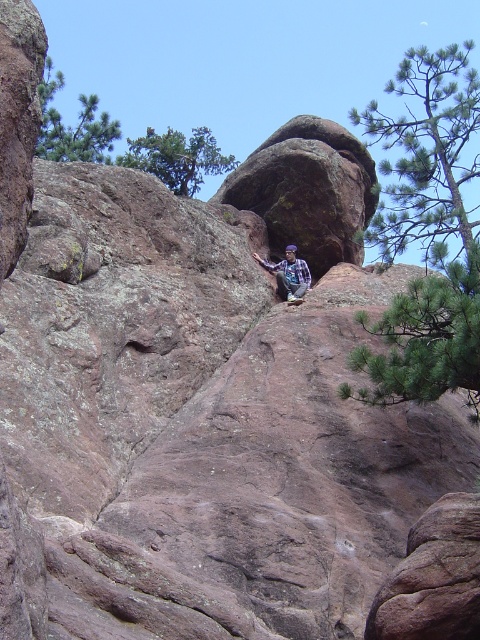
You are an outdoor enthusiast planning to take a photo of the large rock formation. You notice two trees in the upper left corner of your viewfinder. Which tree, the green leafy tree at upper left or the green textured pine tree at upper left, would be a better choice to include in the foreground to frame the rock formation without blocking it?

The green leafy tree at upper left is thinner than the green textured pine tree at upper left, so the green leafy tree at upper left would be a better choice to include in the foreground as it is less likely to block the view of the rock formation.